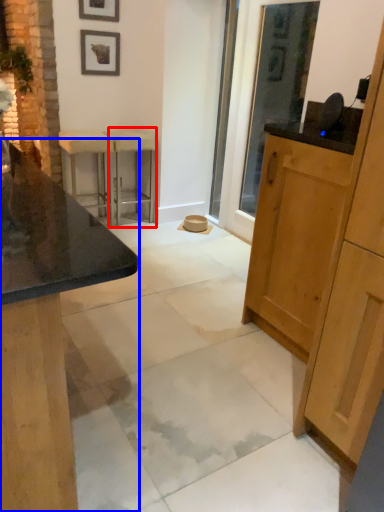
Question: Which point is closer to the camera, bar stool (highlighted by a red box) or cabinetry (highlighted by a blue box)?

Choices:
 (A) bar stool
 (B) cabinetry

Answer: (B)